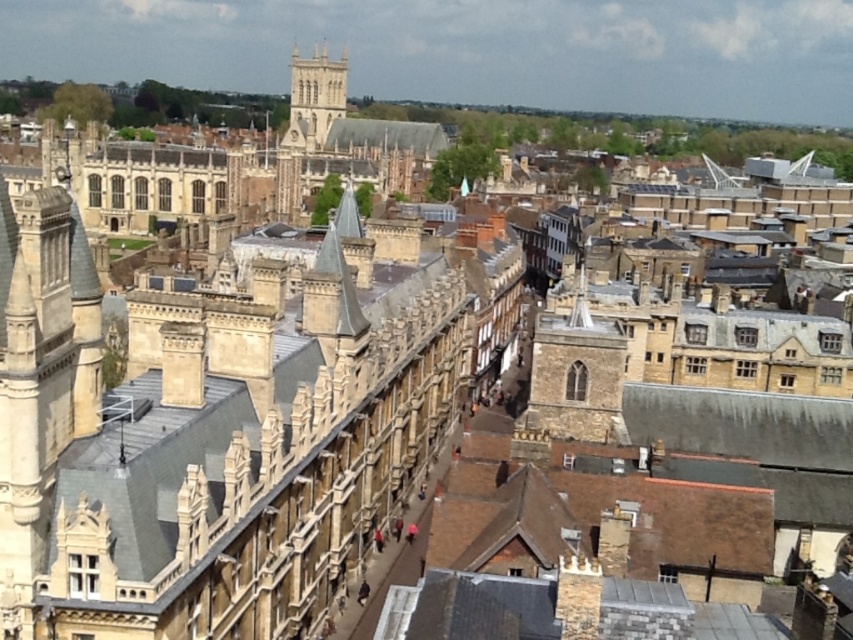
Which of these two, brown stone tower at center-right or golden stone tower at upper center, stands shorter?

brown stone tower at center-right is shorter.

Who is more forward, (590,362) or (294,90)?

Point (590,362) is in front.

Where is `brown stone tower at center-right`? This screenshot has width=853, height=640. brown stone tower at center-right is located at coordinates (573, 378).